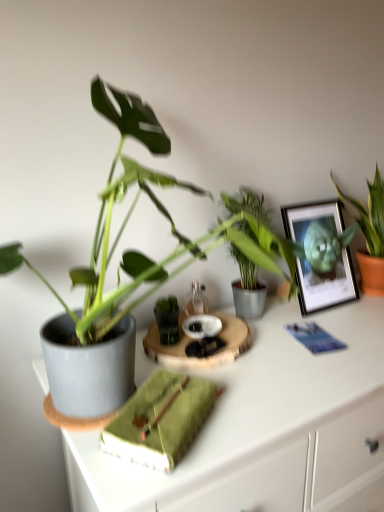
Identify the location of free point above green fabric book at center (from a real-world perspective). The width and height of the screenshot is (384, 512). (165, 403).